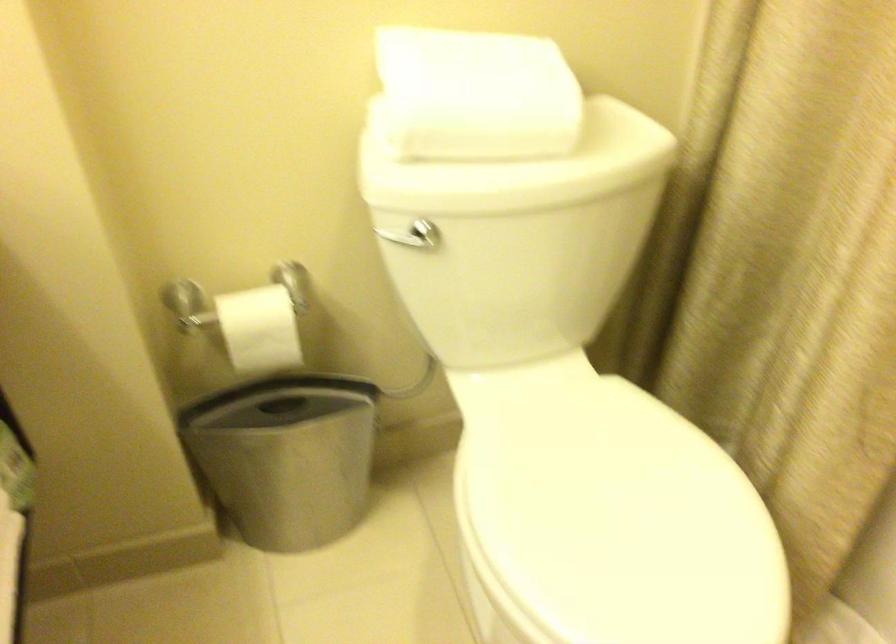
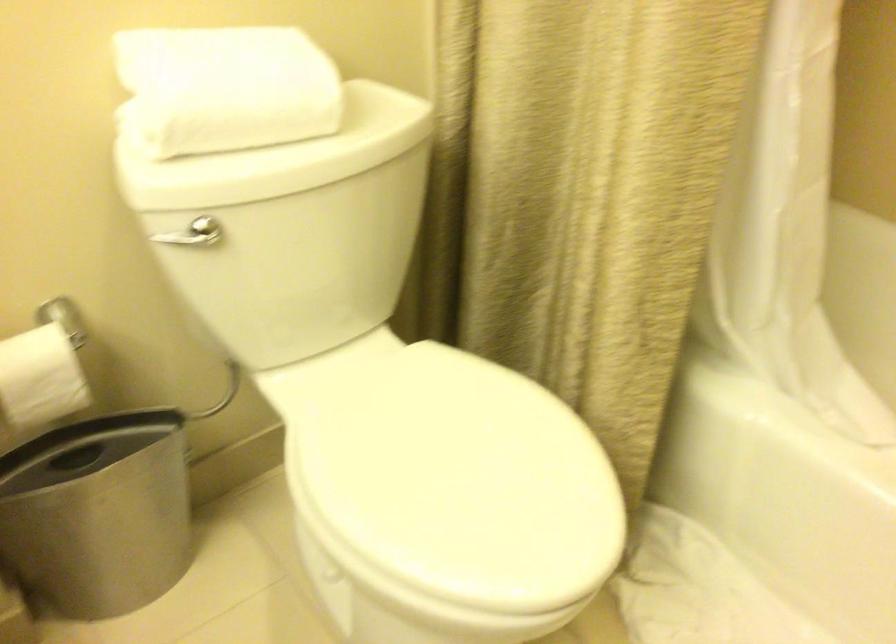
Find the pixel in the second image that matches the point at 592,533 in the first image.

(442, 485)